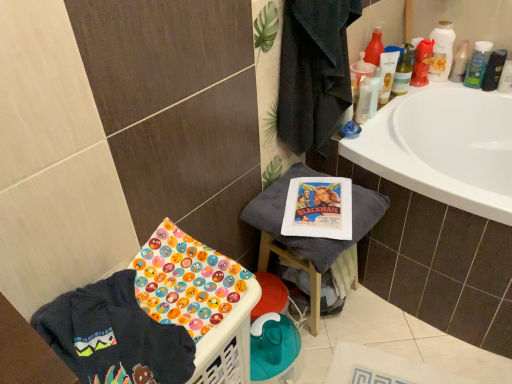
Question: Would you say translucent plastic mouthwash at upper right, arranged as the third mouthwash when viewed from the right, is to the left or to the right of green plastic mouthwash at upper right, the 2th mouthwash viewed from the right, in the picture?

Choices:
 (A) left
 (B) right

Answer: (A)

Question: Would you say translucent plastic mouthwash at upper right, acting as the 4th mouthwash starting from the left, is inside or outside green plastic mouthwash at upper right, the 2th mouthwash viewed from the right?

Choices:
 (A) inside
 (B) outside

Answer: (B)

Question: Considering the real-world distances, which object is closest to the translucent plastic mouthwash at upper right, arranged as the third mouthwash when viewed from the right?

Choices:
 (A) white cotton towel at center
 (B) translucent plastic bottle at upper right
 (C) translucent plastic mouthwash at upper right, the second mouthwash when ordered from left to right
 (D) translucent plastic mouthwash at upper right, positioned as the fourth mouthwash in right-to-left order
 (E) white plastic mouthwash at upper right, the sixth mouthwash from the right

Answer: (D)

Question: Which of these objects is positioned farthest from the white cotton towel at center?

Choices:
 (A) translucent plastic bottle at upper right
 (B) translucent plastic mouthwash at upper right, arranged as the third mouthwash when viewed from the right
 (C) translucent plastic mouthwash at upper right, the fifth mouthwash positioned from the right
 (D) translucent plastic mouthwash at upper right, positioned as the fourth mouthwash in right-to-left order
 (E) dark blue cotton t-shirt at lower left

Answer: (A)